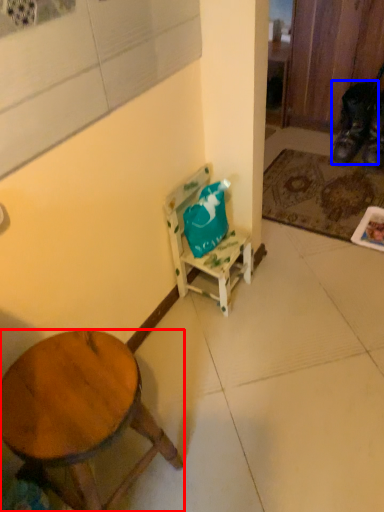
Question: Among these objects, which one is farthest to the camera, desk (highlighted by a red box) or shoe (highlighted by a blue box)?

Choices:
 (A) desk
 (B) shoe

Answer: (B)